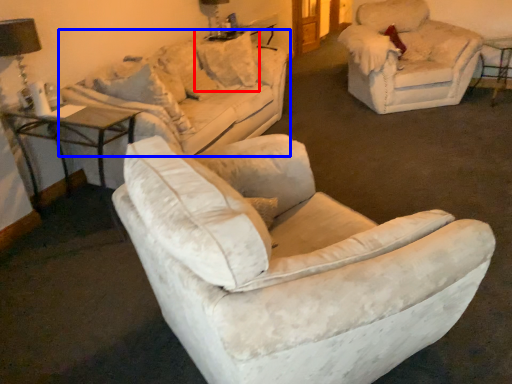
Question: Which object is closer to the camera taking this photo, pillow (highlighted by a red box) or studio couch (highlighted by a blue box)?

Choices:
 (A) pillow
 (B) studio couch

Answer: (B)